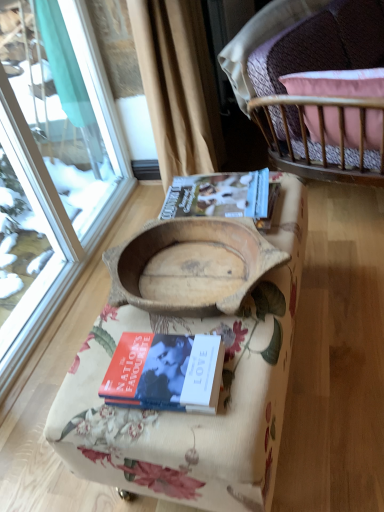
You are a GUI agent. You are given a task and a screenshot of the screen. Output one action in this format:
    pyautogui.click(x=<x>, y=<y>)
    Task: Click on the vacant point to the left of hardcover book at center, which is the first book from bottom to top
    Image resolution: width=384 pixels, height=512 pixels.
    Given the screenshot: What is the action you would take?
    pyautogui.click(x=90, y=392)